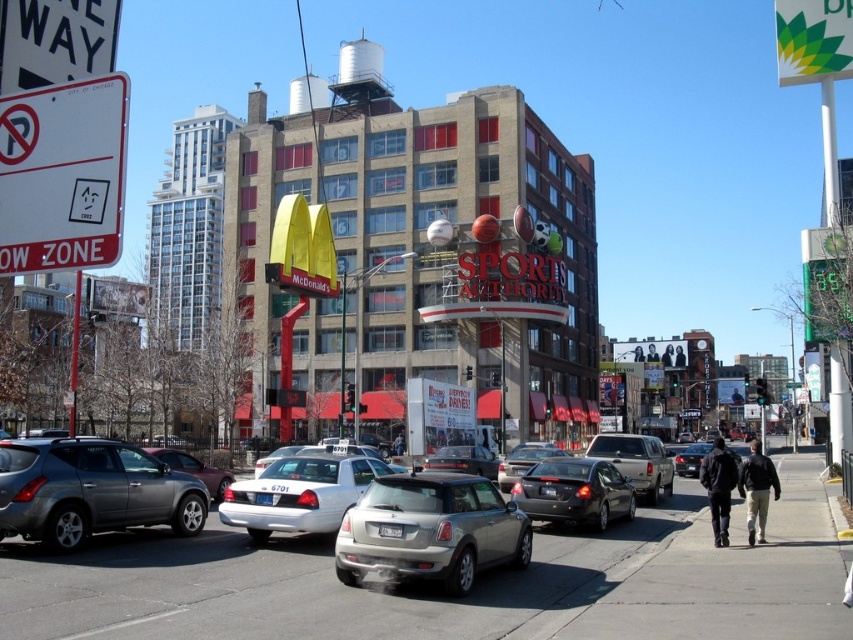
Question: Which point appears farthest from the camera in this image?

Choices:
 (A) (303, 481)
 (B) (535, 477)
 (C) (30, 140)
 (D) (637, 440)

Answer: (D)

Question: Does satin silver car at center have a larger size compared to dark brown leather jacket at lower right?

Choices:
 (A) yes
 (B) no

Answer: (B)

Question: From the image, what is the correct spatial relationship of silver metallic suv at left in relation to white matte sedan at center?

Choices:
 (A) below
 (B) above

Answer: (B)

Question: Which object is positioned farthest from the metallic silver sedan at center-left?

Choices:
 (A) white matte sedan at center
 (B) dark blue jacket at lower right

Answer: (B)

Question: Which point is farther to the camera?

Choices:
 (A) shiny black sedan at center
 (B) white matte sedan at center

Answer: (A)

Question: Is gray asphalt at center wider than dark blue jacket at lower right?

Choices:
 (A) no
 (B) yes

Answer: (A)